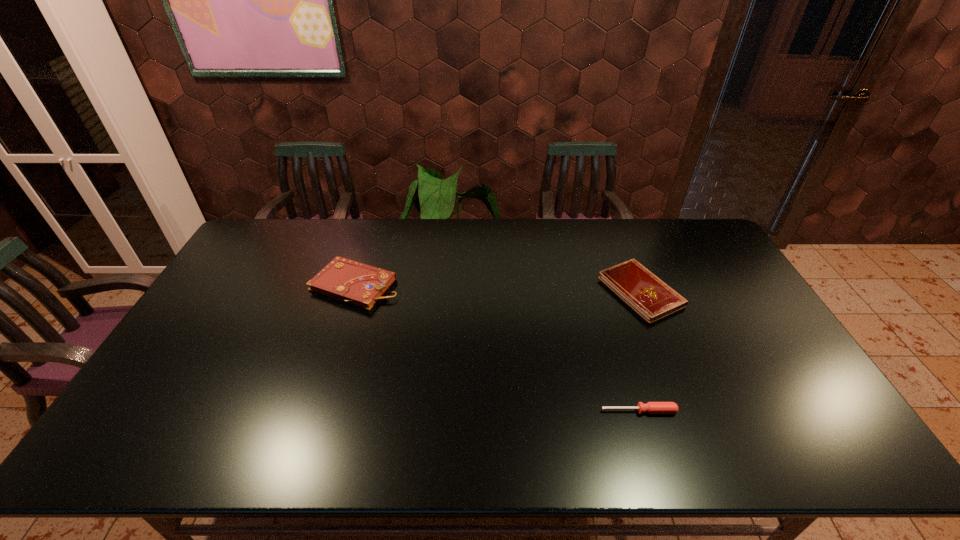
Where is `the leftmost object`? The height and width of the screenshot is (540, 960). the leftmost object is located at coordinates (345, 280).

Where is `the left notebook`? the left notebook is located at coordinates (345, 280).

Where is `the nearest object`? The height and width of the screenshot is (540, 960). the nearest object is located at coordinates (651, 407).

At what (x,y) coordinates should I click in order to perform the action: click on the right notebook. Please return your answer as a coordinate pair (x, y). Looking at the image, I should click on (650, 297).

Identify the location of free space located 0.200m on the front of the left notebook. The height and width of the screenshot is (540, 960). (330, 363).

Where is `vacant space located 0.120m on the left of the screwdriver`? This screenshot has width=960, height=540. vacant space located 0.120m on the left of the screwdriver is located at coordinates (553, 411).

Where is `vacant space located 0.050m on the back of the right notebook`? The width and height of the screenshot is (960, 540). vacant space located 0.050m on the back of the right notebook is located at coordinates (626, 255).

You are a GUI agent. You are given a task and a screenshot of the screen. Output one action in this format:
    pyautogui.click(x=<x>, y=<y>)
    Task: Click on the vacant space at the far edge of the desktop
    The height and width of the screenshot is (540, 960).
    Given the screenshot: What is the action you would take?
    pyautogui.click(x=339, y=249)

In the image, there is a desktop. Where is `free space at the near edge`? The image size is (960, 540). free space at the near edge is located at coordinates (576, 455).

Locate an element on the screen. This screenshot has height=540, width=960. vacant space at the left edge of the desktop is located at coordinates (239, 308).